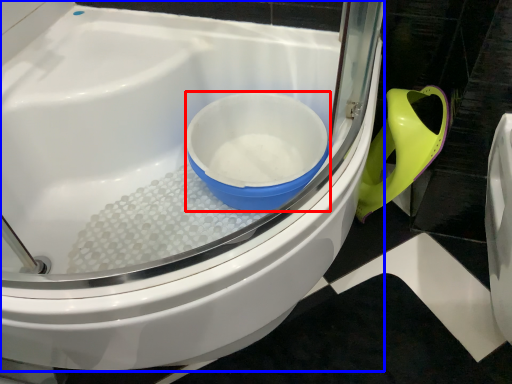
Question: Which object appears closest to the camera in this image, mixing bowl (highlighted by a red box) or toilet (highlighted by a blue box)?

Choices:
 (A) mixing bowl
 (B) toilet

Answer: (B)